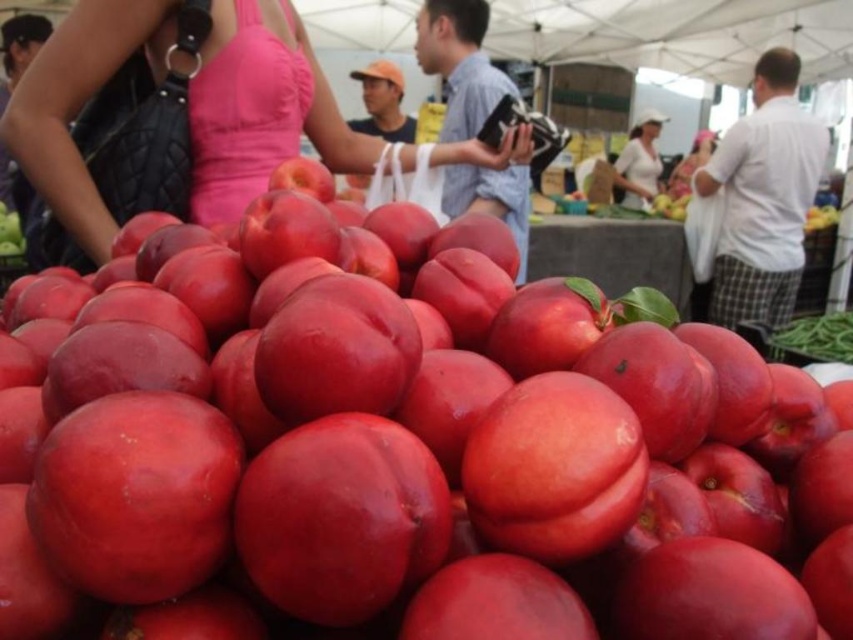
In the market scene, you see a matte pink dress at upper center and a white matte shirt at upper center. Which one of these items is bigger in size?

The matte pink dress at upper center is larger in size than the white matte shirt at upper center.

You are a photographer at the market and want to capture both the matte pink dress at upper center and the white matte shirt at upper center in a single shot. Which one is closer to the camera?

The matte pink dress at upper center is positioned under the white matte shirt at upper center, so the white matte shirt at upper center is closer to the camera.

In the scene shown: You are a photographer setting up a camera in this market scene. You need to decide if the matte pink dress at upper center and the white matte shirt at upper center will fit within a 1.2 meter wide frame. Which one is wider?

The matte pink dress at upper center might be wider than white matte shirt at upper center, so the matte pink dress at upper center may not fit within the 1.2 meter wide frame if it exceeds the width, but the white matte shirt at upper center likely fits. However, without exact measurements, it is uncertain.